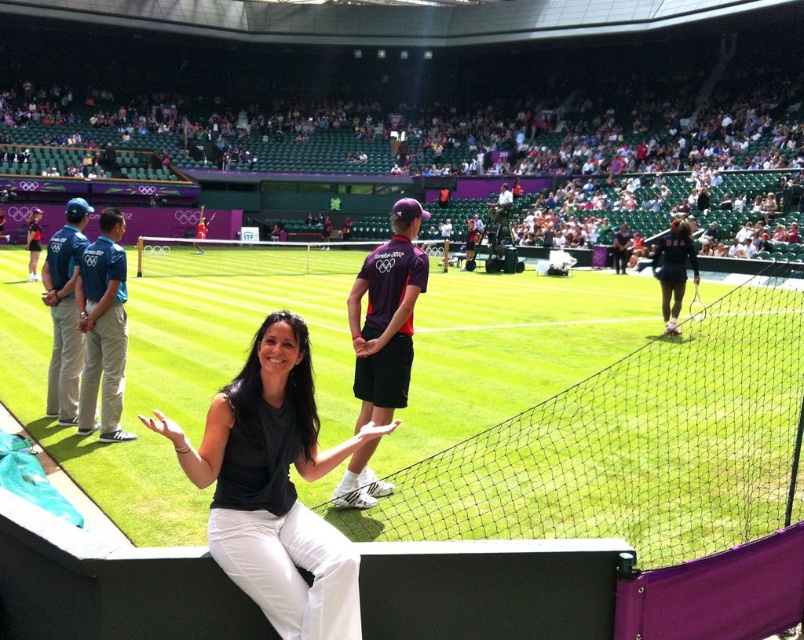
You are a photographer at the tennis match. You need to capture a photo of the black matte shirt at center and the khaki cotton pants at left. Which object is wider in the image?

The black matte shirt at center is wider than the khaki cotton pants at left according to the description.

You are a photographer at the tennis match and want to capture a photo of the black matte shirt at center and khaki cotton pants at left. Which object is more to the left in the frame?

The khaki cotton pants at left are more to the left than the black matte shirt at center.

You are a photographer positioned at the bottom left corner of the tennis court. You need to capture a photo of the purple fabric shirt at center. Based on the scene description, can you determine if the shirt is within your camera frame?

The purple fabric shirt at center is located at point (388, 316), which is near the center of the image. Since photographers typically aim for central subjects, it should be within the frame.